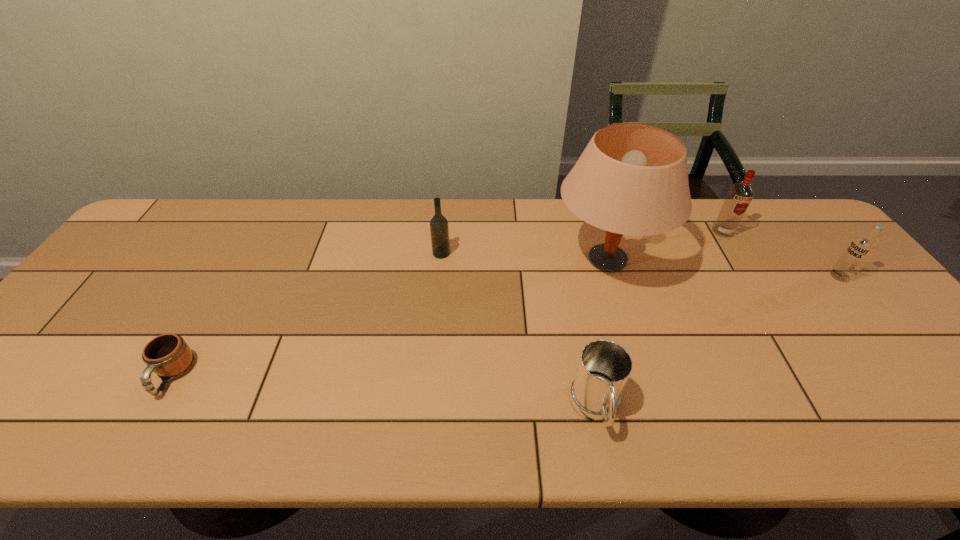
Locate an element on the screen. The width and height of the screenshot is (960, 540). the tallest object is located at coordinates (632, 179).

I want to click on the second vodka from right to left, so [740, 195].

Identify the location of the fifth object from left to right. Image resolution: width=960 pixels, height=540 pixels. (740, 195).

I want to click on the leftmost vodka, so click(x=439, y=230).

What are the coordinates of `the second farthest vodka` in the screenshot? It's located at (439, 230).

Where is `the rightmost object`? This screenshot has height=540, width=960. the rightmost object is located at coordinates (861, 249).

Locate an element on the screen. This screenshot has width=960, height=540. the nearest vodka is located at coordinates (861, 249).

I want to click on the taller mug, so click(604, 367).

Where is `the fifth tallest object`? The height and width of the screenshot is (540, 960). the fifth tallest object is located at coordinates (604, 367).

The width and height of the screenshot is (960, 540). I want to click on the leftmost object, so click(168, 355).